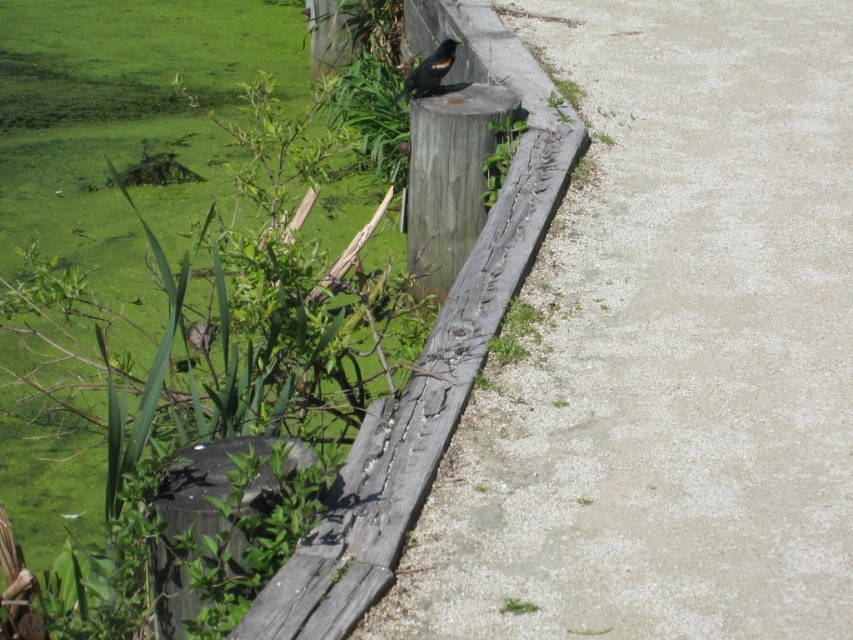
Question: Is weathered wood curb at center to the right of shiny black bird at upper center from the viewer's perspective?

Choices:
 (A) yes
 (B) no

Answer: (A)

Question: Among these objects, which one is nearest to the camera?

Choices:
 (A) shiny black bird at upper center
 (B) weathered wood curb at center
 (C) gray concrete sidewalk at center

Answer: (B)

Question: Can you confirm if gray concrete sidewalk at center is thinner than weathered wood curb at center?

Choices:
 (A) no
 (B) yes

Answer: (A)

Question: Can you confirm if gray concrete sidewalk at center is positioned above shiny black bird at upper center?

Choices:
 (A) yes
 (B) no

Answer: (B)

Question: Among these points, which one is nearest to the camera?

Choices:
 (A) (527, 163)
 (B) (763, 378)
 (C) (409, 81)

Answer: (B)

Question: Which point appears closest to the camera in this image?

Choices:
 (A) (442, 45)
 (B) (509, 227)

Answer: (B)